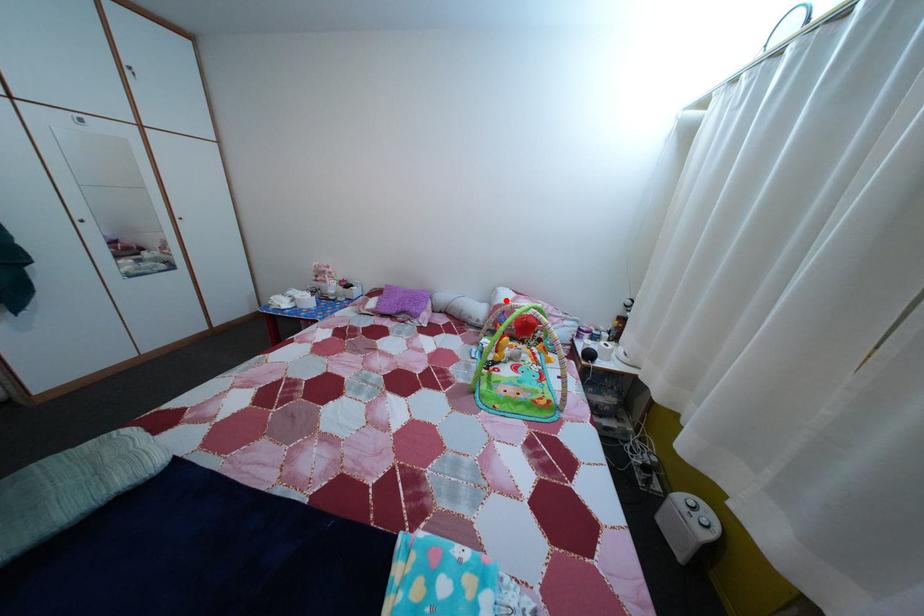
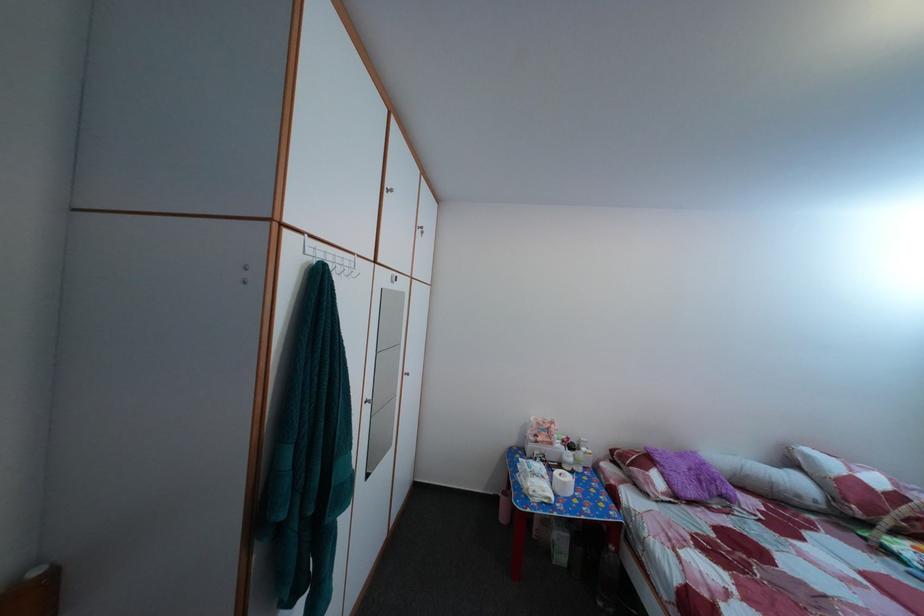
Locate, in the second image, the point that corresponds to the highlighted location in the first image.

(817, 464)